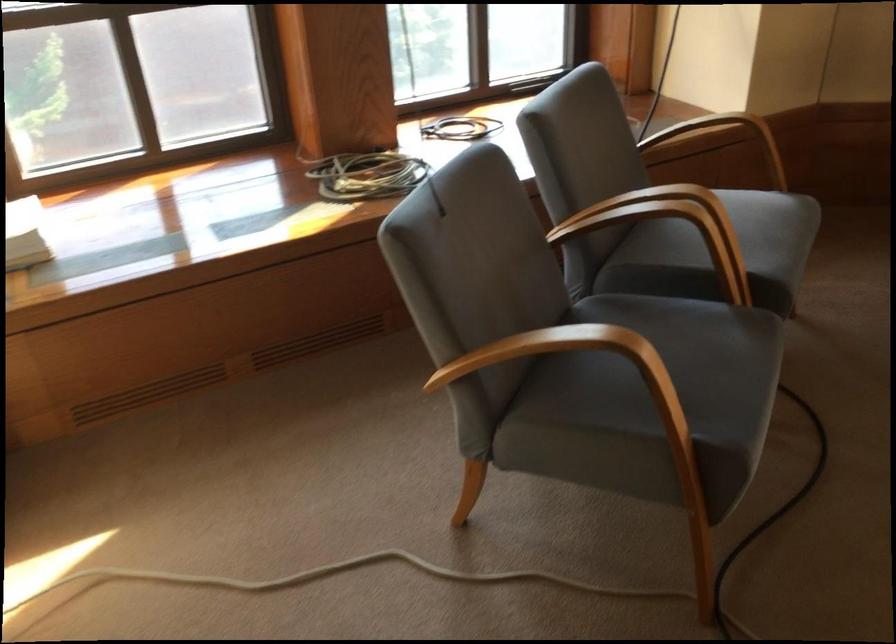
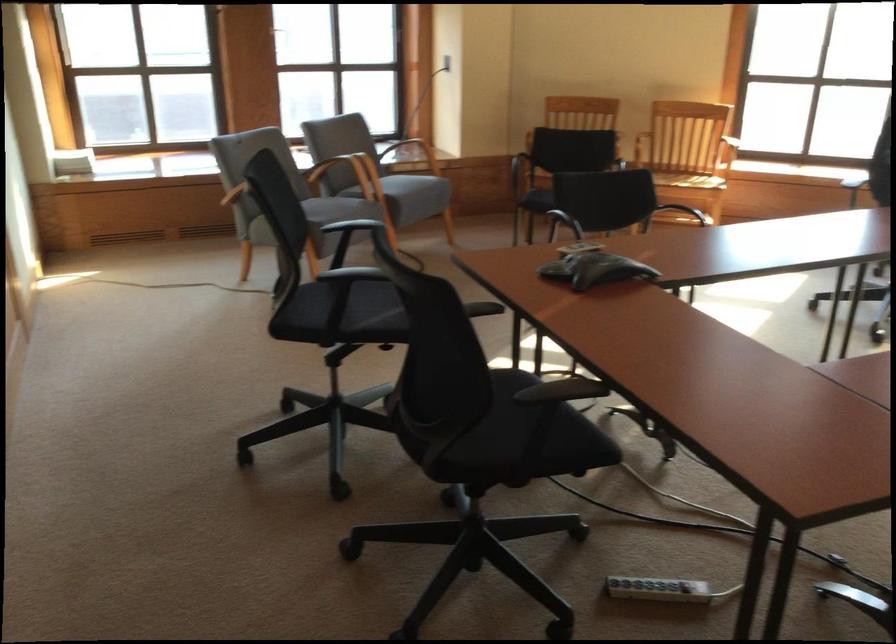
In the second image, find the point that corresponds to (x=711, y=281) in the first image.

(362, 178)